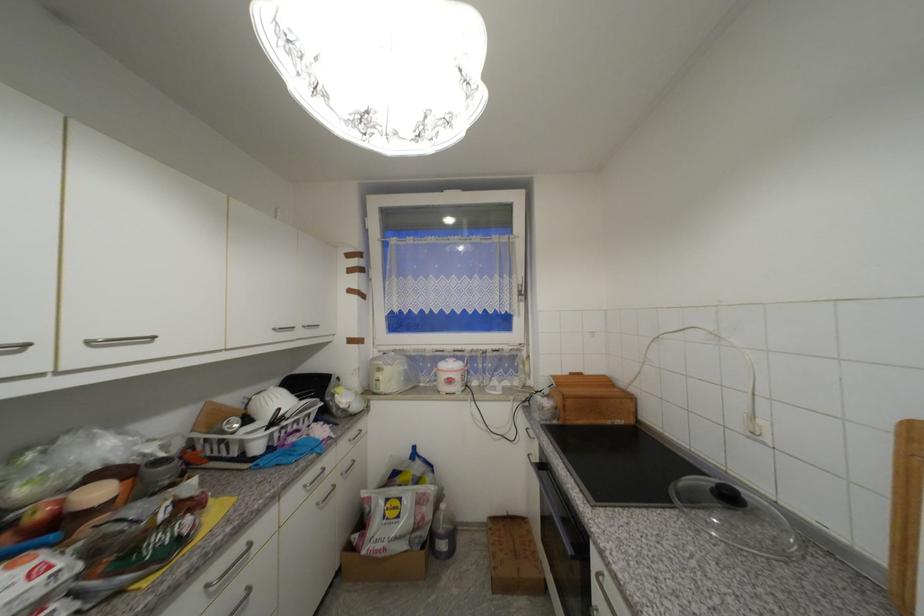
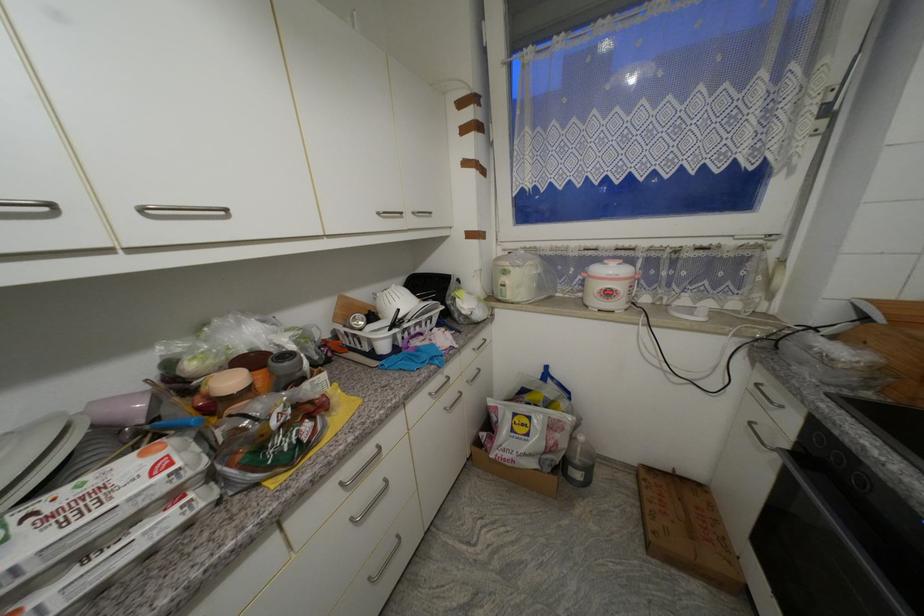
Find the pixel in the second image that matches point 456,382 in the first image.

(614, 294)